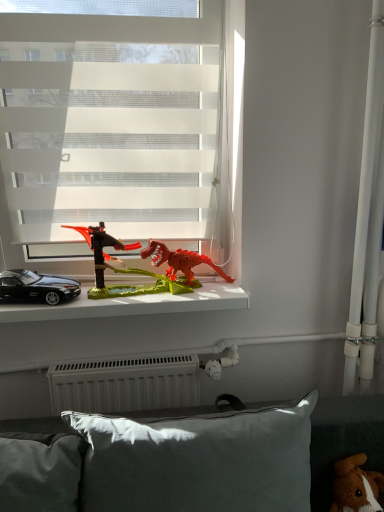
Question: Considering the relative sizes of white translucent blinds at upper center and black matte car at left in the image provided, is white translucent blinds at upper center thinner than black matte car at left?

Choices:
 (A) no
 (B) yes

Answer: (A)

Question: From a real-world perspective, does white translucent blinds at upper center stand above black matte car at left?

Choices:
 (A) no
 (B) yes

Answer: (B)

Question: Is white translucent blinds at upper center not inside black matte car at left?

Choices:
 (A) yes
 (B) no

Answer: (A)

Question: Considering the relative positions of white translucent blinds at upper center and black matte car at left in the image provided, is white translucent blinds at upper center to the right of black matte car at left from the viewer's perspective?

Choices:
 (A) yes
 (B) no

Answer: (A)

Question: Does white translucent blinds at upper center have a smaller size compared to black matte car at left?

Choices:
 (A) yes
 (B) no

Answer: (B)

Question: Is white translucent blinds at upper center oriented away from black matte car at left?

Choices:
 (A) yes
 (B) no

Answer: (B)

Question: Is white translucent blinds at upper center facing away from gray fabric pillow at lower center?

Choices:
 (A) yes
 (B) no

Answer: (B)

Question: Is the depth of white translucent blinds at upper center greater than that of gray fabric pillow at lower center?

Choices:
 (A) yes
 (B) no

Answer: (A)

Question: From the image's perspective, is white translucent blinds at upper center beneath gray fabric pillow at lower center?

Choices:
 (A) yes
 (B) no

Answer: (B)

Question: From a real-world perspective, is white translucent blinds at upper center positioned under gray fabric pillow at lower center based on gravity?

Choices:
 (A) yes
 (B) no

Answer: (B)

Question: From the image's perspective, is white translucent blinds at upper center over gray fabric pillow at lower center?

Choices:
 (A) no
 (B) yes

Answer: (B)

Question: Is white translucent blinds at upper center at the left side of gray fabric pillow at lower center?

Choices:
 (A) yes
 (B) no

Answer: (A)

Question: Considering the relative sizes of black plastic car at left and brown plush toy at lower right, the 1th toy viewed from the right, in the image provided, is black plastic car at left bigger than brown plush toy at lower right, the 1th toy viewed from the right,?

Choices:
 (A) no
 (B) yes

Answer: (B)